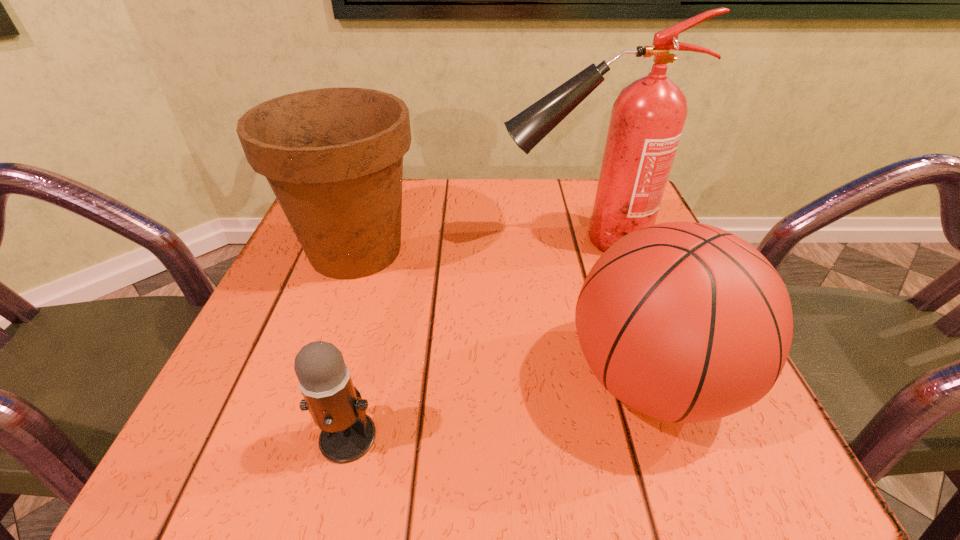
Where is `empty space that is in between the microphone and the tallest object`? The height and width of the screenshot is (540, 960). empty space that is in between the microphone and the tallest object is located at coordinates (465, 339).

Image resolution: width=960 pixels, height=540 pixels. Identify the location of unoccupied position between the fire extinguisher and the flowerpot. (468, 246).

The height and width of the screenshot is (540, 960). Identify the location of free point between the basketball and the shortest object. (500, 408).

This screenshot has height=540, width=960. What are the coordinates of `vacant region between the basketball and the flowerpot` in the screenshot? It's located at (503, 315).

Identify the location of free point between the flowerpot and the tallest object. pos(468,246).

Find the location of a particular element. object that ranks as the third closest to the flowerpot is located at coordinates (685, 322).

Point out which object is positioned as the second nearest to the tallest object. Please provide its 2D coordinates. Your answer should be formatted as a tuple, i.e. [(x, y)], where the tuple contains the x and y coordinates of a point satisfying the conditions above.

[(685, 322)]

This screenshot has width=960, height=540. I want to click on free space that satisfies the following two spatial constraints: 1. at the nozzle end of the basketball; 2. on the right side of the fire extinguisher, so click(621, 380).

You are a GUI agent. You are given a task and a screenshot of the screen. Output one action in this format:
    pyautogui.click(x=<x>, y=<y>)
    Task: Click on the vacant space that satisfies the following two spatial constraints: 1. at the nozzle end of the tallest object; 2. on the front side of the shortest object
    
    Given the screenshot: What is the action you would take?
    pyautogui.click(x=637, y=436)

Find the location of `vacant space that satisfies the following two spatial constraints: 1. at the nozzle end of the basketball; 2. on the right side of the tallest object`. vacant space that satisfies the following two spatial constraints: 1. at the nozzle end of the basketball; 2. on the right side of the tallest object is located at coordinates (621, 380).